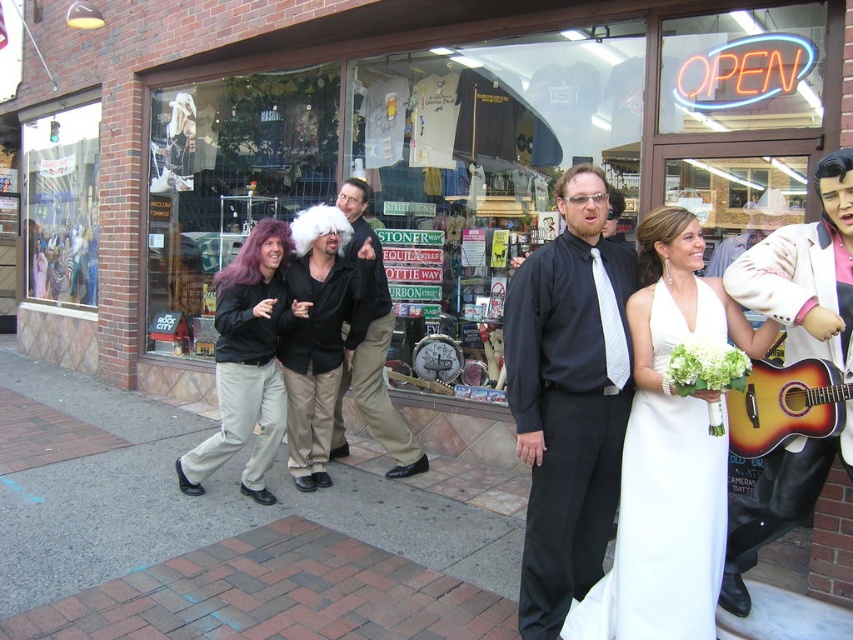
You are standing at the point labeled point [74,268] and want to walk to the point labeled point [297,458]. Which direction should you face to move towards your destination?

To move from point [74,268] to point [297,458], you should face towards the northeast direction since the destination point is northeast of your current position.